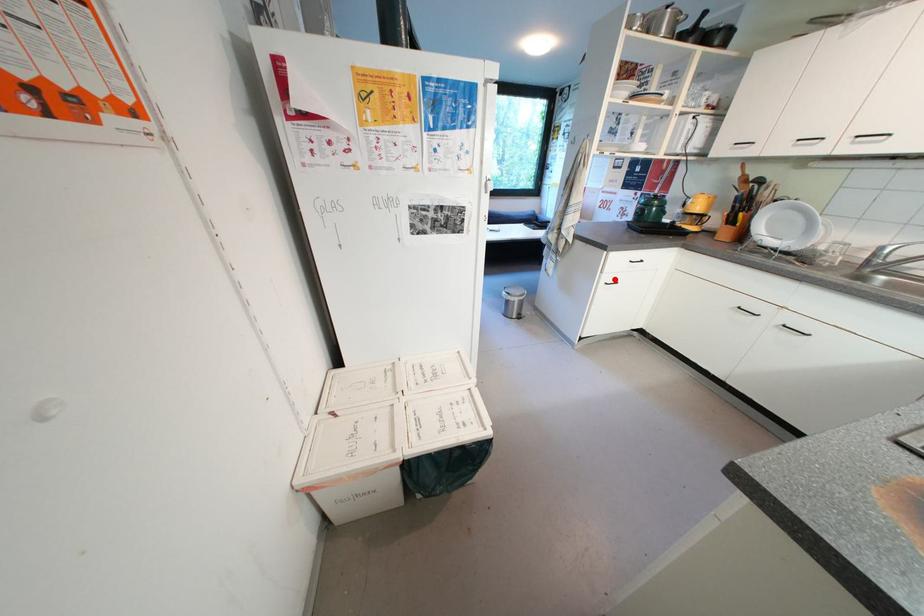
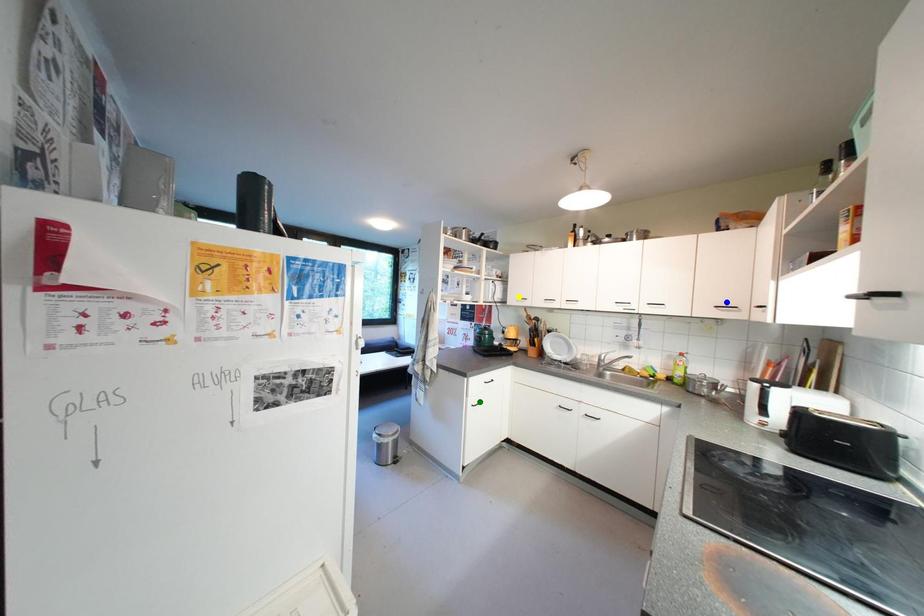
Question: I am providing you with two images of the same scene from different viewpoints. A red point is marked on the first image. You are given multiple points on the second image. Which point in image 2 represents the same 3d spot as the red point in image 1?

Choices:
 (A) yellow point
 (B) green point
 (C) blue point

Answer: (B)